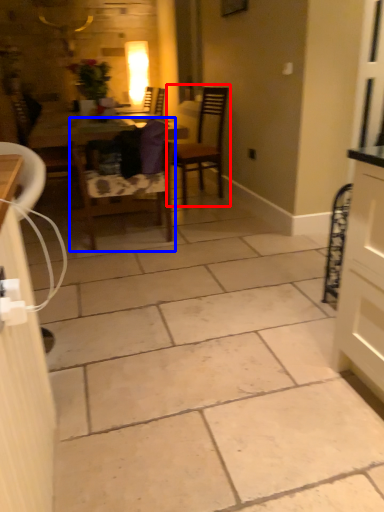
Question: Which of the following is the farthest to the observer, chair (highlighted by a red box) or chair (highlighted by a blue box)?

Choices:
 (A) chair
 (B) chair

Answer: (A)